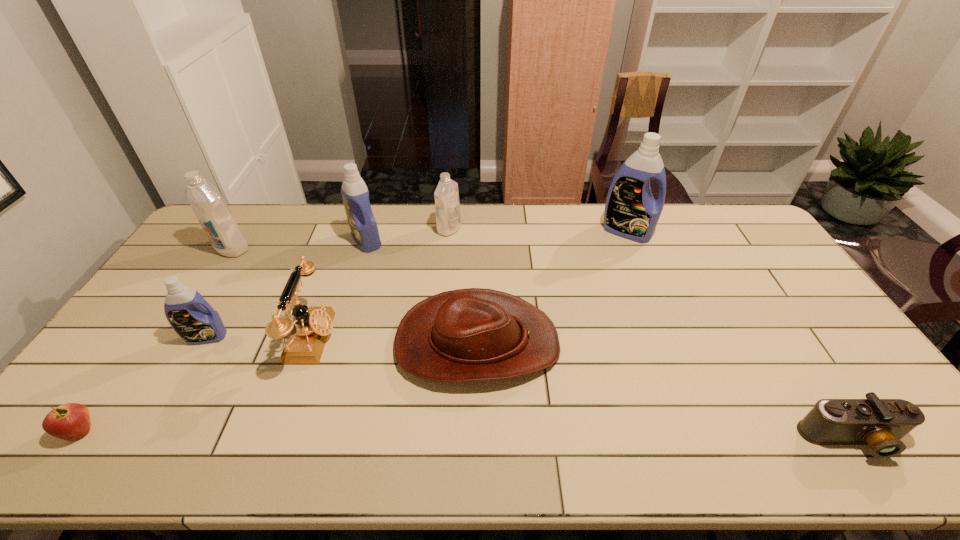
The height and width of the screenshot is (540, 960). I want to click on vacant space situated on the back of the apple, so click(x=174, y=299).

The width and height of the screenshot is (960, 540). I want to click on apple situated at the near edge, so click(x=70, y=421).

Find the location of a particular element. camera that is at the near edge is located at coordinates (880, 423).

Locate an element on the screen. The width and height of the screenshot is (960, 540). detergent present at the left edge is located at coordinates (215, 217).

Locate an element on the screen. This screenshot has width=960, height=540. apple that is at the left edge is located at coordinates (70, 421).

Image resolution: width=960 pixels, height=540 pixels. What are the coordinates of `object situated at the right edge` in the screenshot? It's located at (880, 423).

The height and width of the screenshot is (540, 960). I want to click on object that is at the far left corner, so click(x=215, y=217).

Locate an element on the screen. object present at the near left corner is located at coordinates (70, 421).

Find the location of a particular element. object located in the near right corner section of the desktop is located at coordinates (880, 423).

Where is `blank space at the far edge of the desktop`? The image size is (960, 540). blank space at the far edge of the desktop is located at coordinates (285, 212).